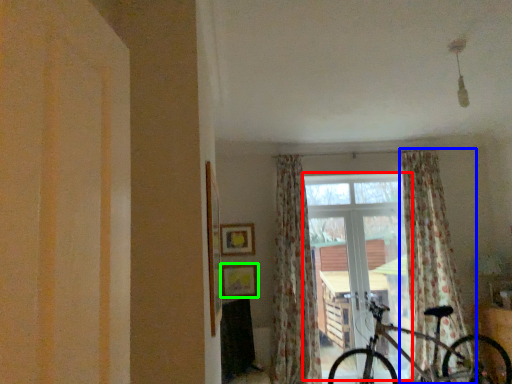
Question: Which is nearer to the window (highlighted by a red box)? curtain (highlighted by a blue box) or picture frame (highlighted by a green box).

Choices:
 (A) curtain
 (B) picture frame

Answer: (A)